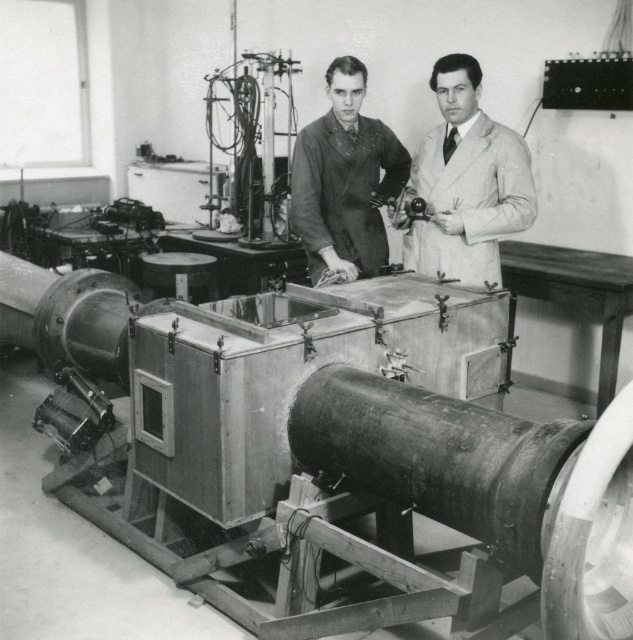
Question: Does white wool coat at center have a greater width compared to smooth black suit at center?

Choices:
 (A) no
 (B) yes

Answer: (B)

Question: Is white wool coat at center behind smooth black suit at center?

Choices:
 (A) yes
 (B) no

Answer: (B)

Question: Which point is closer to the camera?

Choices:
 (A) smooth black suit at center
 (B) white wool coat at center

Answer: (B)

Question: Which point is closer to the camera?

Choices:
 (A) (329, 109)
 (B) (511, 220)

Answer: (B)

Question: Is white wool coat at center further to camera compared to smooth black suit at center?

Choices:
 (A) no
 (B) yes

Answer: (A)

Question: Among these objects, which one is nearest to the camera?

Choices:
 (A) white wool coat at center
 (B) smooth black suit at center

Answer: (A)